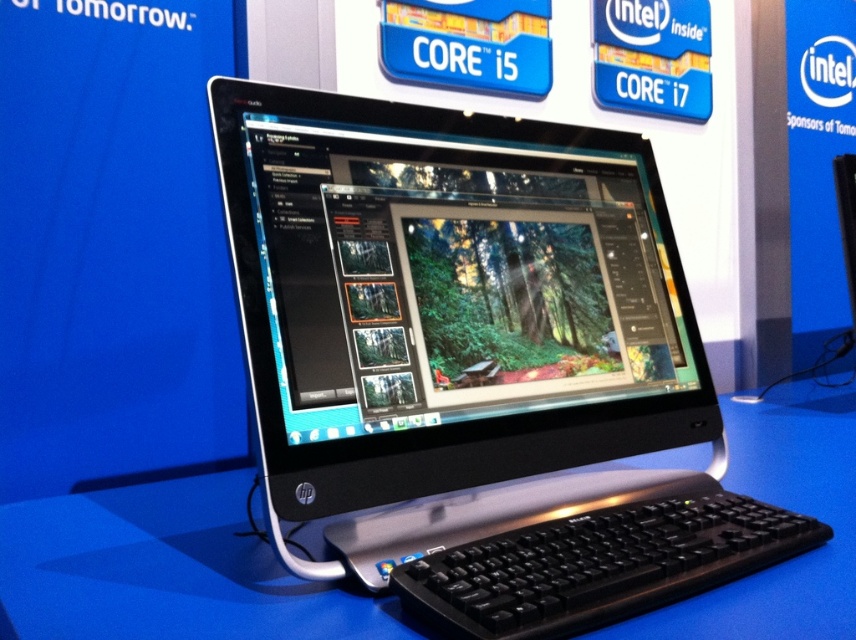
Question: Which of the following is the closest to the observer?

Choices:
 (A) (578, 470)
 (B) (354, 595)
 (C) (474, 554)

Answer: (C)

Question: Does black plastic monitor at center appear on the left side of black plastic keyboard at lower center?

Choices:
 (A) no
 (B) yes

Answer: (B)

Question: Does black plastic desktop at center appear on the left side of black plastic keyboard at lower center?

Choices:
 (A) yes
 (B) no

Answer: (B)

Question: Can you confirm if black plastic desktop at center is smaller than black plastic keyboard at lower center?

Choices:
 (A) yes
 (B) no

Answer: (B)

Question: Which of the following is the farthest from the observer?

Choices:
 (A) (490, 609)
 (B) (477, 193)

Answer: (B)

Question: Which object is the farthest from the black plastic desktop at center?

Choices:
 (A) black plastic keyboard at lower center
 (B) black plastic monitor at center

Answer: (B)